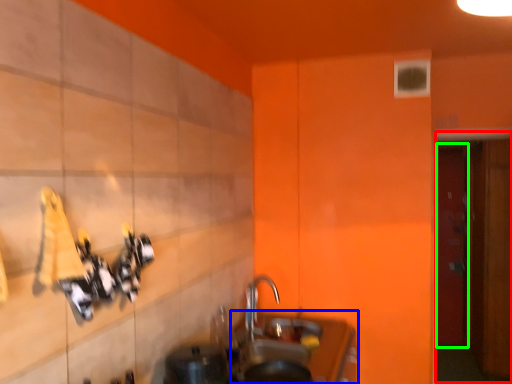
Question: Which object is the farthest from door (highlighted by a red box)? Choose among these: counter top (highlighted by a blue box) or door (highlighted by a green box).

Choices:
 (A) counter top
 (B) door

Answer: (B)